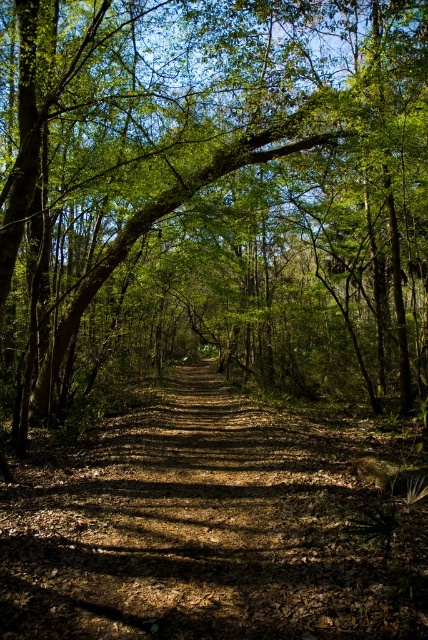
Question: Can you confirm if green leafy tree at center is positioned below brown dirt trail at center?

Choices:
 (A) no
 (B) yes

Answer: (A)

Question: Which point appears farthest from the camera in this image?

Choices:
 (A) (306, 557)
 (B) (240, 358)

Answer: (B)

Question: Among these points, which one is nearest to the camera?

Choices:
 (A) (255, 563)
 (B) (0, 16)

Answer: (A)

Question: Does green leafy tree at center appear over brown dirt trail at center?

Choices:
 (A) no
 (B) yes

Answer: (B)

Question: Which point appears closest to the camera in this image?

Choices:
 (A) (228, 28)
 (B) (23, 573)

Answer: (B)

Question: Is green leafy tree at center positioned in front of brown dirt trail at center?

Choices:
 (A) yes
 (B) no

Answer: (B)